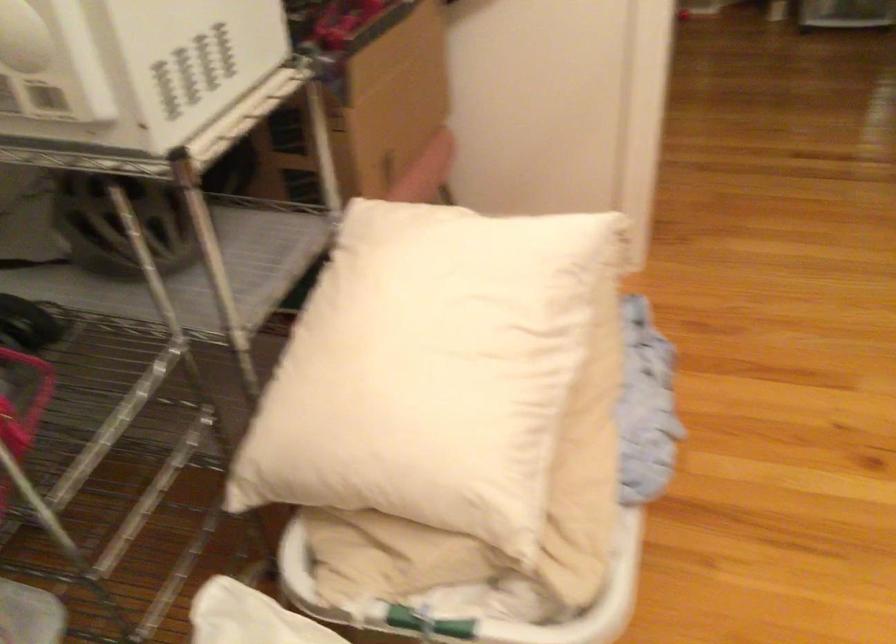
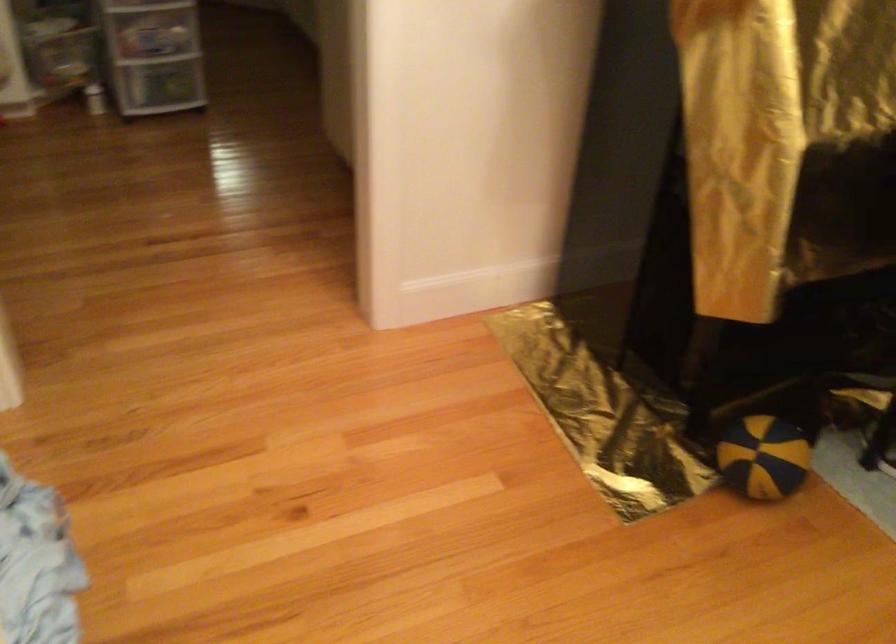
Question: The camera is either moving clockwise (left) or counter-clockwise (right) around the object. The first image is from the beginning of the video and the second image is from the end. Is the camera moving left or right when shooting the video?

Choices:
 (A) Left
 (B) Right

Answer: (A)